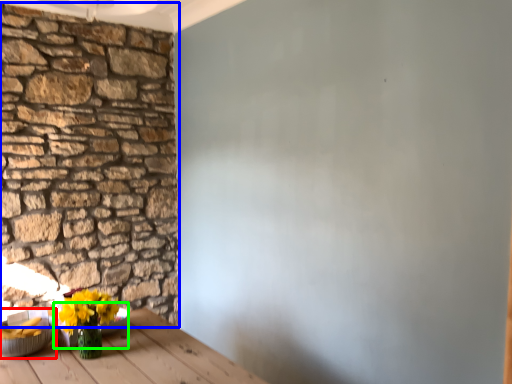
Question: Considering the real-world distances, which object is closest to bowl (highlighted by a red box)? brick (highlighted by a blue box) or bowl (highlighted by a green box).

Choices:
 (A) brick
 (B) bowl

Answer: (B)